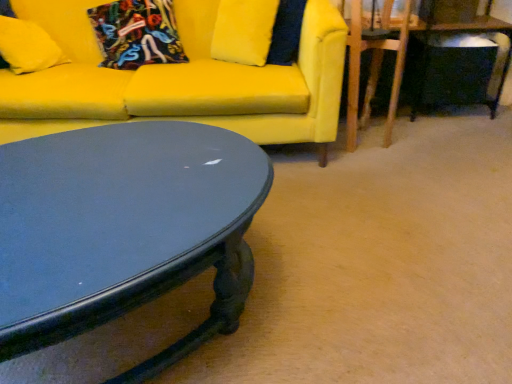
Question: Considering the relative sizes of matte black table at lower right and wooden swivel chair at right in the image provided, is matte black table at lower right wider than wooden swivel chair at right?

Choices:
 (A) yes
 (B) no

Answer: (A)

Question: Is the depth of matte black table at lower right less than that of wooden swivel chair at right?

Choices:
 (A) no
 (B) yes

Answer: (A)

Question: From a real-world perspective, is matte black table at lower right under wooden swivel chair at right?

Choices:
 (A) yes
 (B) no

Answer: (A)

Question: From the image's perspective, is matte black table at lower right located above wooden swivel chair at right?

Choices:
 (A) yes
 (B) no

Answer: (A)

Question: Can we say matte black table at lower right lies outside wooden swivel chair at right?

Choices:
 (A) yes
 (B) no

Answer: (A)

Question: Relative to matte yellow pillow at upper left, the second pillow positioned from the right, is matte yellow couch at upper left in front or behind?

Choices:
 (A) front
 (B) behind

Answer: (A)

Question: From a real-world perspective, is matte yellow couch at upper left positioned above or below matte yellow pillow at upper left, marked as the 1th pillow in a left-to-right arrangement?

Choices:
 (A) below
 (B) above

Answer: (A)

Question: Considering the positions of point [230, 74] and point [51, 66], is point [230, 74] closer or farther from the camera than point [51, 66]?

Choices:
 (A) closer
 (B) farther

Answer: (A)

Question: Considering the positions of matte yellow couch at upper left and matte yellow pillow at upper left, the second pillow positioned from the right, in the image, is matte yellow couch at upper left bigger or smaller than matte yellow pillow at upper left, the second pillow positioned from the right,?

Choices:
 (A) big
 (B) small

Answer: (A)

Question: Is point (155, 77) closer or farther from the camera than point (486, 21)?

Choices:
 (A) closer
 (B) farther

Answer: (A)

Question: In the image, is matte yellow couch at upper left positioned in front of or behind matte black table at lower right?

Choices:
 (A) front
 (B) behind

Answer: (A)

Question: Looking at their shapes, would you say matte yellow couch at upper left is wider or thinner than matte black table at lower right?

Choices:
 (A) thin
 (B) wide

Answer: (B)

Question: Considering the relative positions of matte yellow couch at upper left and matte black table at lower right in the image provided, is matte yellow couch at upper left to the left or to the right of matte black table at lower right?

Choices:
 (A) right
 (B) left

Answer: (B)

Question: From the image's perspective, is velvet floral pillow at upper left, acting as the 1th pillow starting from the right, positioned above or below matte yellow couch at upper left?

Choices:
 (A) below
 (B) above

Answer: (B)

Question: Considering the positions of velvet floral pillow at upper left, placed as the 2th pillow when sorted from left to right, and matte yellow couch at upper left in the image, is velvet floral pillow at upper left, placed as the 2th pillow when sorted from left to right, bigger or smaller than matte yellow couch at upper left?

Choices:
 (A) big
 (B) small

Answer: (B)